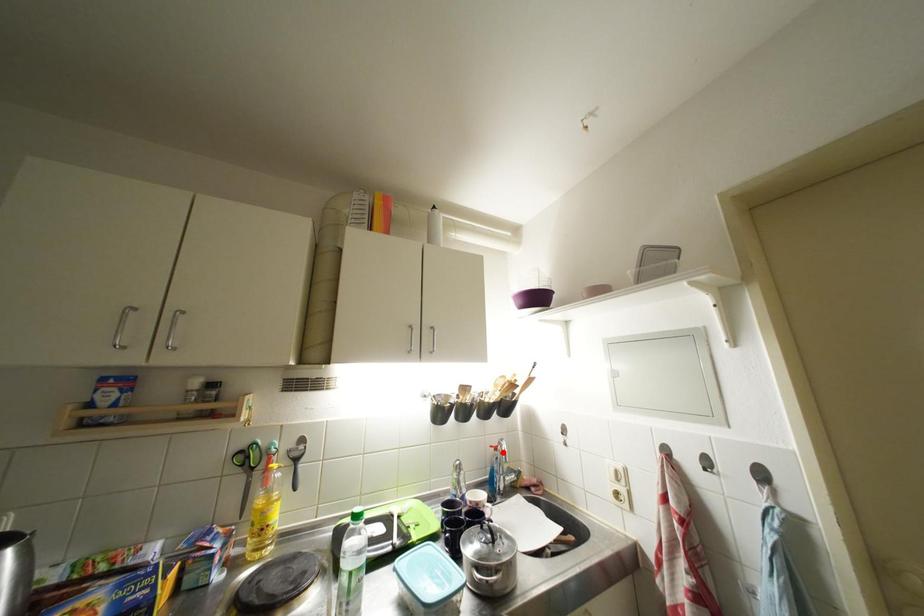
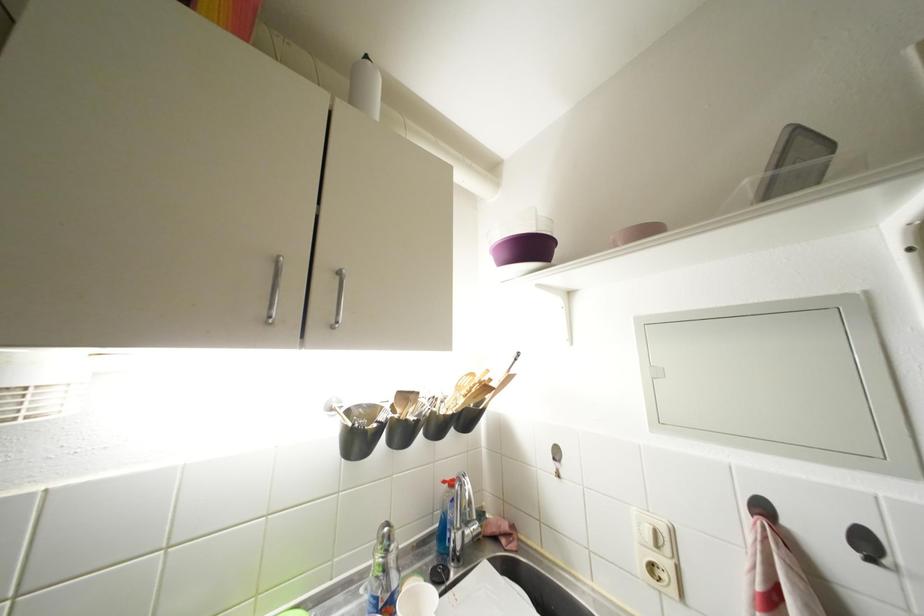
Question: A red point is marked in image1. In image2, is the corresponding 3D point closer to the camera or farther? Reply with the corresponding letter.

Choices:
 (A) The corresponding 3D point is closer.
 (B) The corresponding 3D point is farther.

Answer: (A)